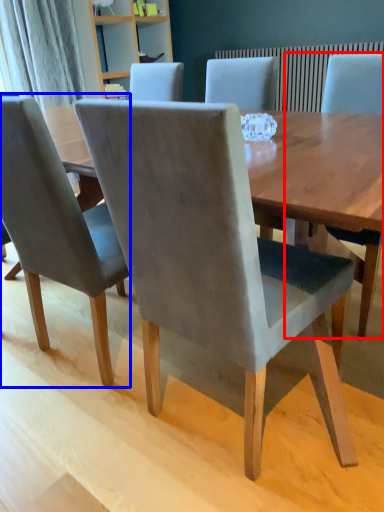
Question: Which object is further to the camera taking this photo, chair (highlighted by a red box) or chair (highlighted by a blue box)?

Choices:
 (A) chair
 (B) chair

Answer: (A)